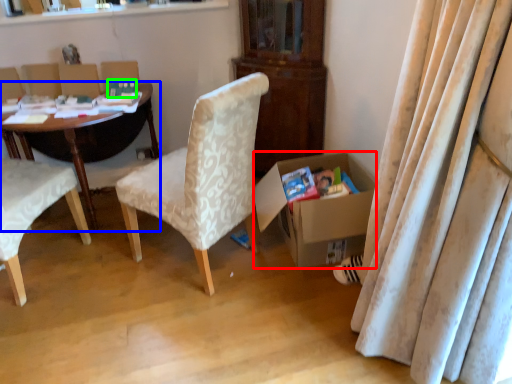
Question: Which object is positioned closest to box (highlighted by a red box)? Select from desk (highlighted by a blue box) and paperback book (highlighted by a green box).

Choices:
 (A) desk
 (B) paperback book

Answer: (B)